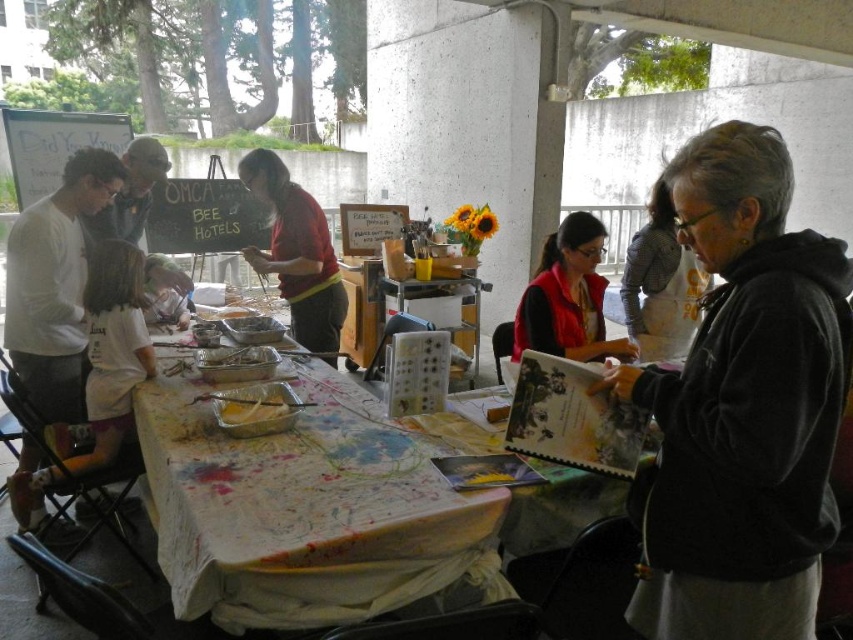
Based on the photo, where is the black hoodie at center located in the image?

The black hoodie at center is located at point 0.633 in the x coordinate and 0.872 in the y coordinate.